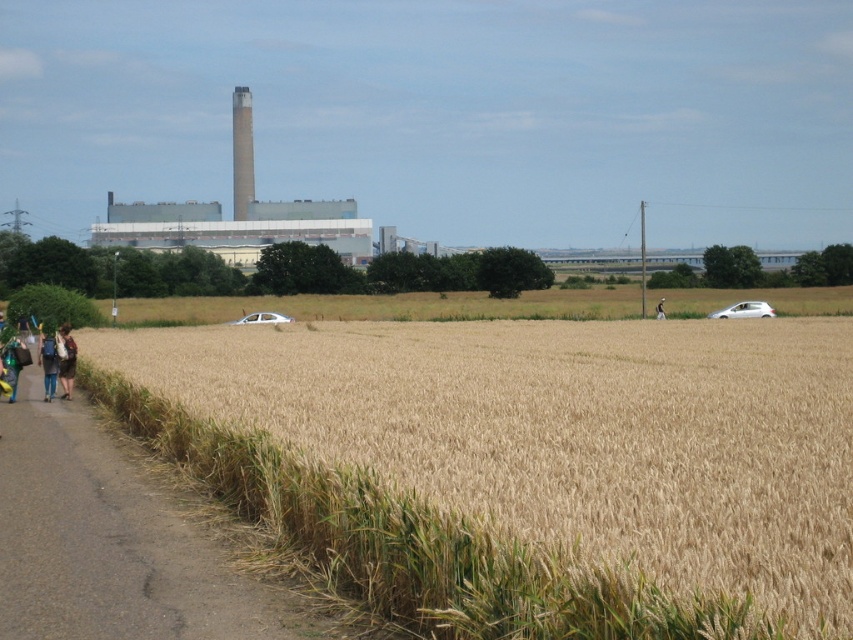
From the picture: You are standing at the point marked by the coordinate point at (526, 465). Based on the scene, what is the most prominent feature directly in front of you?

The point marked by the coordinate point at (526, 465) is located in the golden wheat field at left, so the most prominent feature directly in front of you would be the golden wheat field itself.

You are a farmer planning to plant crops in the golden wheat field at left and asphalt road at lower left. Which area has enough space for planting a large crop field?

The golden wheat field at left has a larger size compared to asphalt road at lower left, so it has enough space for planting a large crop field.

You are a hiker standing at the asphalt road at lower left and want to reach the golden wheat field at left. Which direction should you move to get there?

The golden wheat field at left is located above the asphalt road at lower left, so you should move upward from the asphalt road at lower left to reach the golden wheat field at left.